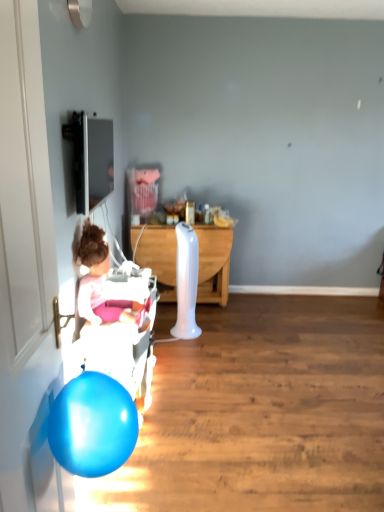
Question: Considering the positions of point (117, 352) and point (142, 305), is point (117, 352) closer or farther from the camera than point (142, 305)?

Choices:
 (A) closer
 (B) farther

Answer: (A)

Question: Is white plastic baby carriage at left situated inside pink fabric at left or outside?

Choices:
 (A) inside
 (B) outside

Answer: (B)

Question: Based on their relative distances, which object is farther from the white wood desk at center?

Choices:
 (A) white plastic baby carriage at left
 (B) glossy blue balloon at lower left
 (C) pink fabric at left
 (D) white glossy door at left
 (E) matte black tv at upper left

Answer: (D)

Question: Which is nearer to the glossy blue balloon at lower left?

Choices:
 (A) white glossy door at left
 (B) matte black tv at upper left
 (C) pink fabric at left
 (D) white plastic baby carriage at left
 (E) white wood desk at center

Answer: (A)